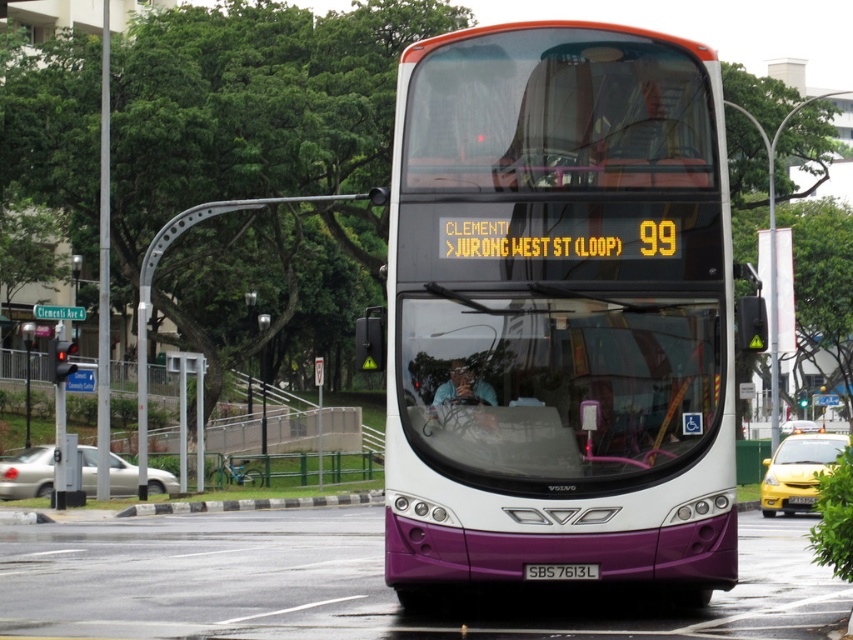
Question: Does purple matte bus at center have a smaller size compared to purple matte license plate at center?

Choices:
 (A) no
 (B) yes

Answer: (A)

Question: Can you confirm if purple matte bus at center is positioned above black rubber curb at lower center?

Choices:
 (A) no
 (B) yes

Answer: (B)

Question: Which object is closer to the camera taking this photo?

Choices:
 (A) black rubber curb at lower center
 (B) purple matte license plate at center

Answer: (B)

Question: Does purple matte bus at center have a smaller size compared to black rubber curb at lower center?

Choices:
 (A) yes
 (B) no

Answer: (A)

Question: Which point is closer to the camera?

Choices:
 (A) tap(262, 500)
 (B) tap(431, 115)
 (C) tap(555, 570)

Answer: (C)

Question: Considering the real-world distances, which object is closest to the purple matte license plate at center?

Choices:
 (A) purple matte bus at center
 (B) black rubber curb at lower center

Answer: (A)